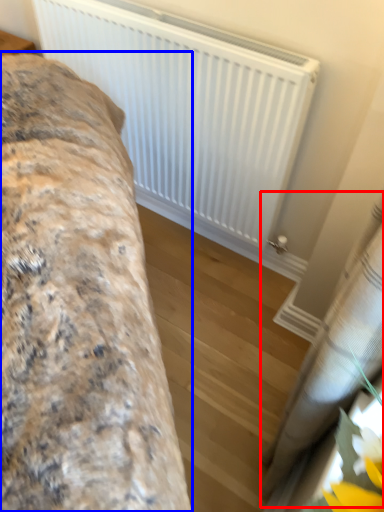
Question: Which object appears farthest to the camera in this image, curtain (highlighted by a red box) or furniture (highlighted by a blue box)?

Choices:
 (A) curtain
 (B) furniture

Answer: (B)